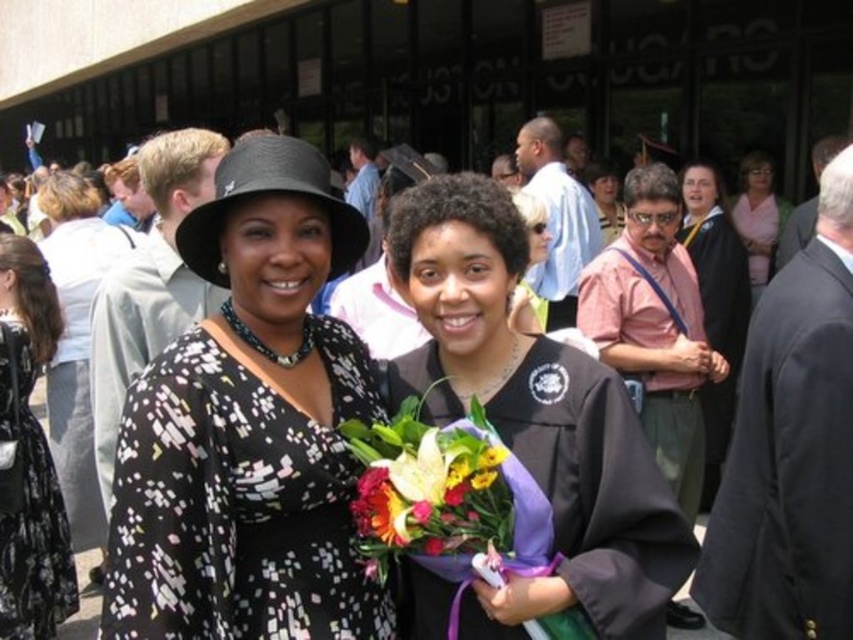
Question: Which object appears closest to the camera in this image?

Choices:
 (A) black matte dress at center
 (B) pink fabric at upper right

Answer: (A)

Question: Can you confirm if vibrant floral bouquet at center is positioned to the right of black floral dress at lower left?

Choices:
 (A) yes
 (B) no

Answer: (A)

Question: Where is black matte graduation gown at center located in relation to matte black graduation gown at right in the image?

Choices:
 (A) below
 (B) above

Answer: (A)

Question: Which point appears farthest from the camera in this image?

Choices:
 (A) (689, 198)
 (B) (12, 492)
 (C) (416, 465)
 (D) (334, 426)

Answer: (A)

Question: Is black matte graduation gown at center positioned before matte black graduation gown at right?

Choices:
 (A) yes
 (B) no

Answer: (A)

Question: Which point is farther from the camera taking this photo?

Choices:
 (A) (462, 410)
 (B) (738, 195)
 (C) (10, 355)
 (D) (697, 212)

Answer: (B)